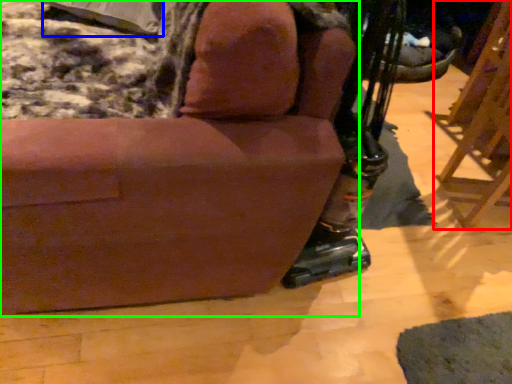
Question: Which object is the closest to the furniture (highlighted by a red box)? Choose among these: pillow (highlighted by a blue box) or chair (highlighted by a green box).

Choices:
 (A) pillow
 (B) chair

Answer: (B)